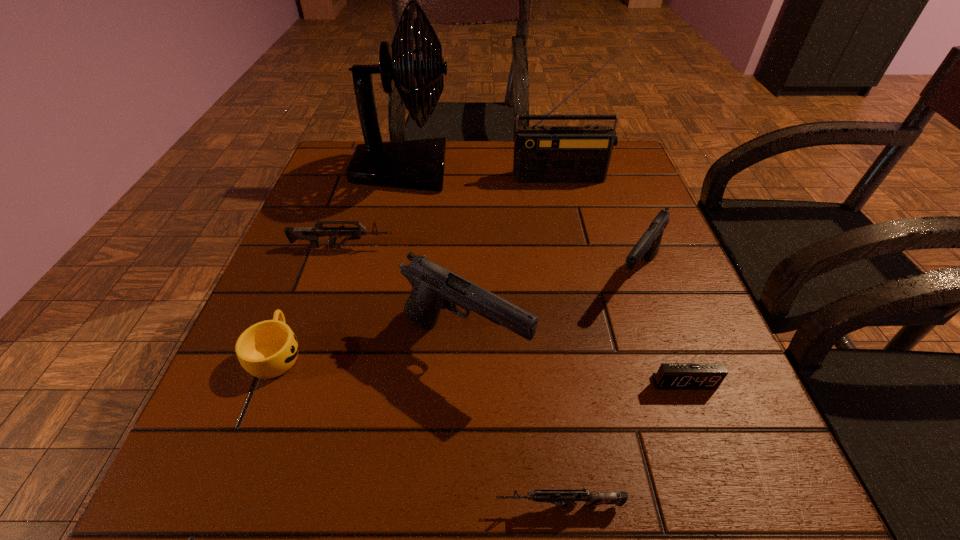
What are the coordinates of `the nearest object` in the screenshot? It's located at (567, 498).

At what (x,y) coordinates should I click in order to perform the action: click on the nearest gun. Please return your answer as a coordinate pair (x, y). The width and height of the screenshot is (960, 540). Looking at the image, I should click on (567, 498).

Locate an element on the screen. Image resolution: width=960 pixels, height=540 pixels. free space located in front of the fan to blow air is located at coordinates (511, 170).

Where is `free region located on the front-facing side of the radio receiver`? This screenshot has width=960, height=540. free region located on the front-facing side of the radio receiver is located at coordinates (576, 224).

This screenshot has height=540, width=960. I want to click on vacant point located at the muzzle of the left black gun, so click(663, 346).

In order to click on blank space located 0.360m at the muzzle of the fourth tallest object in this screenshot , I will do `click(725, 520)`.

This screenshot has width=960, height=540. I want to click on vacant region located aimed along the barrel of the leftmost gun, so click(x=451, y=246).

What are the coordinates of `vacant space located on the right of the beige cup` in the screenshot? It's located at (394, 353).

Find the location of a particular element. Image resolution: width=960 pixels, height=540 pixels. vacant space located on the front-facing side of the alarm clock is located at coordinates (700, 427).

Locate an element on the screen. free space located 0.300m aimed along the barrel of the smaller grey gun is located at coordinates (262, 505).